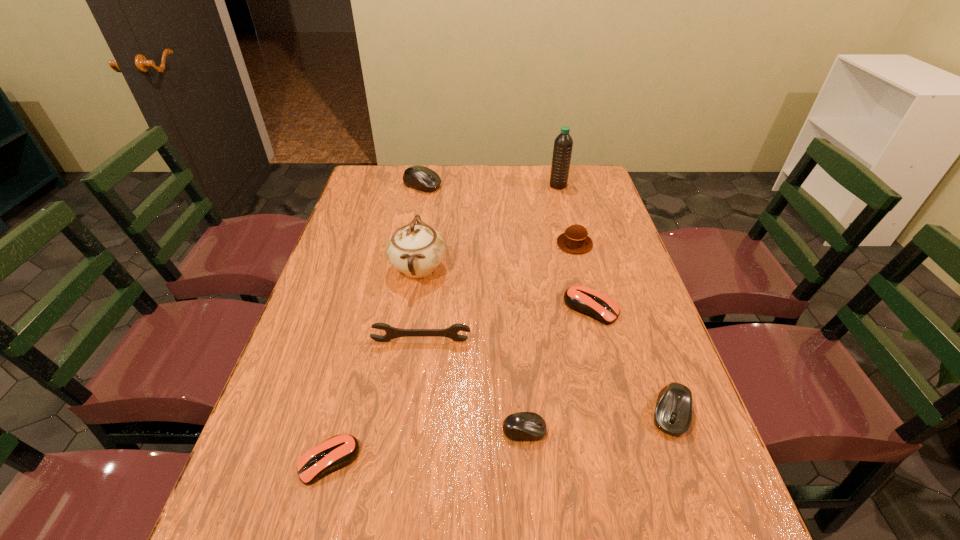
At what (x,y) coordinates should I click in order to perform the action: click on object at the far right corner. Please return your answer as a coordinate pair (x, y). Looking at the image, I should click on (563, 144).

Locate an element on the screen. vacant space at the far edge is located at coordinates (409, 195).

Locate an element on the screen. The image size is (960, 540). vacant space at the left edge of the desktop is located at coordinates (375, 235).

The width and height of the screenshot is (960, 540). In order to click on blank space at the right edge of the desktop in this screenshot , I will do `click(612, 237)`.

In the image, there is a desktop. Find the location of `vacant space at the far left corner`. vacant space at the far left corner is located at coordinates point(401,185).

This screenshot has width=960, height=540. I want to click on vacant point located between the black water bottle and the farthest computer mouse, so click(491, 185).

I want to click on vacant point located between the sixth farthest object and the muffin, so click(x=497, y=292).

Where is `free space between the second nearest orange computer mouse and the second black mouse from left to right`? This screenshot has width=960, height=540. free space between the second nearest orange computer mouse and the second black mouse from left to right is located at coordinates (426, 446).

Where is `empty location between the black water bottle and the brown muffin`? The width and height of the screenshot is (960, 540). empty location between the black water bottle and the brown muffin is located at coordinates (566, 215).

At what (x,y) coordinates should I click in order to perform the action: click on free area in between the second black mouse from right to left and the white chinaware. Please return your answer as a coordinate pair (x, y). The width and height of the screenshot is (960, 540). Looking at the image, I should click on (471, 349).